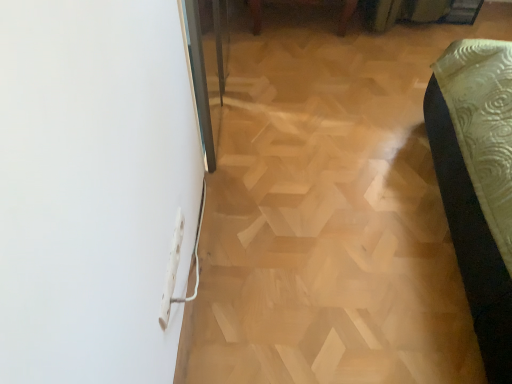
Question: Is white plastic electric outlet at lower left aimed at light wood parquet floor at center?

Choices:
 (A) yes
 (B) no

Answer: (B)

Question: Is white plastic electric outlet at lower left facing away from light wood parquet floor at center?

Choices:
 (A) no
 (B) yes

Answer: (A)

Question: Is white plastic electric outlet at lower left bigger than light wood parquet floor at center?

Choices:
 (A) no
 (B) yes

Answer: (A)

Question: From the image's perspective, is white plastic electric outlet at lower left beneath light wood parquet floor at center?

Choices:
 (A) yes
 (B) no

Answer: (A)

Question: Does white plastic electric outlet at lower left come behind light wood parquet floor at center?

Choices:
 (A) yes
 (B) no

Answer: (B)

Question: Considering the relative positions of white plastic electric outlet at lower left and light wood parquet floor at center in the image provided, is white plastic electric outlet at lower left to the left of light wood parquet floor at center from the viewer's perspective?

Choices:
 (A) yes
 (B) no

Answer: (A)

Question: Is light wood parquet floor at center wider than white plastic electric outlet at lower left?

Choices:
 (A) yes
 (B) no

Answer: (A)

Question: Would you say white plastic electric outlet at lower left is part of light wood parquet floor at center's contents?

Choices:
 (A) no
 (B) yes

Answer: (A)

Question: Can we say light wood parquet floor at center lies outside white plastic electric outlet at lower left?

Choices:
 (A) no
 (B) yes

Answer: (B)

Question: Is the depth of light wood parquet floor at center less than that of white plastic electric outlet at lower left?

Choices:
 (A) no
 (B) yes

Answer: (A)

Question: Considering the relative sizes of light wood parquet floor at center and white plastic electric outlet at lower left in the image provided, is light wood parquet floor at center thinner than white plastic electric outlet at lower left?

Choices:
 (A) yes
 (B) no

Answer: (B)

Question: Does light wood parquet floor at center have a greater height compared to white plastic electric outlet at lower left?

Choices:
 (A) no
 (B) yes

Answer: (A)

Question: From a real-world perspective, relative to white plastic electric outlet at lower left, is light wood parquet floor at center vertically above or below?

Choices:
 (A) below
 (B) above

Answer: (A)